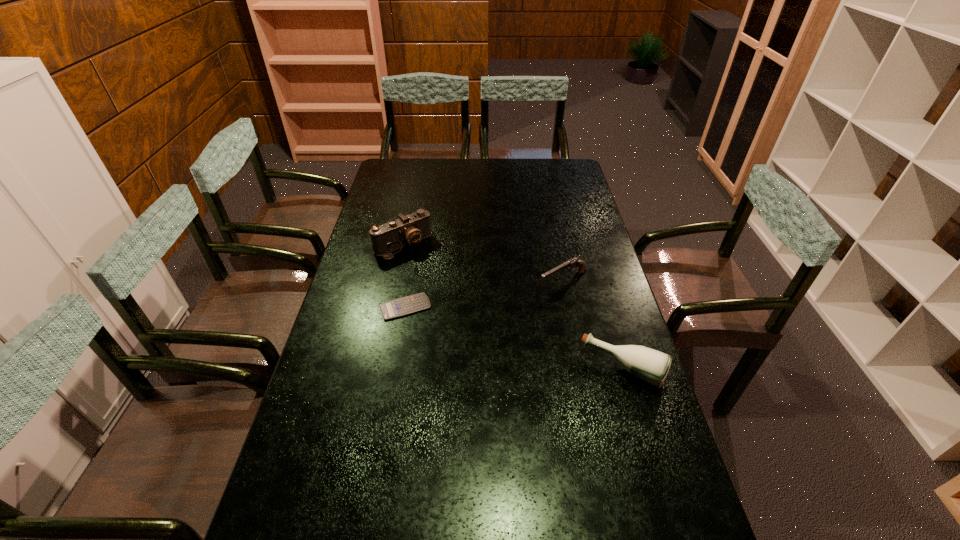
Where is `empty space that is in between the shortest object and the camera`? empty space that is in between the shortest object and the camera is located at coordinates (404, 276).

Choose which object is the third nearest neighbor to the nearest object. Please provide its 2D coordinates. Your answer should be formatted as a tuple, i.e. [(x, y)], where the tuple contains the x and y coordinates of a point satisfying the conditions above.

[(408, 230)]

Identify which object is located as the nearest to the calculator. Please provide its 2D coordinates. Your answer should be formatted as a tuple, i.e. [(x, y)], where the tuple contains the x and y coordinates of a point satisfying the conditions above.

[(408, 230)]

The height and width of the screenshot is (540, 960). I want to click on free point that satisfies the following two spatial constraints: 1. on the front side of the nearest object; 2. on the right side of the gun, so click(581, 368).

Where is `vacant position in the image that satisfies the following two spatial constraints: 1. on the back side of the calculator; 2. on the right side of the gun`? This screenshot has height=540, width=960. vacant position in the image that satisfies the following two spatial constraints: 1. on the back side of the calculator; 2. on the right side of the gun is located at coordinates (409, 282).